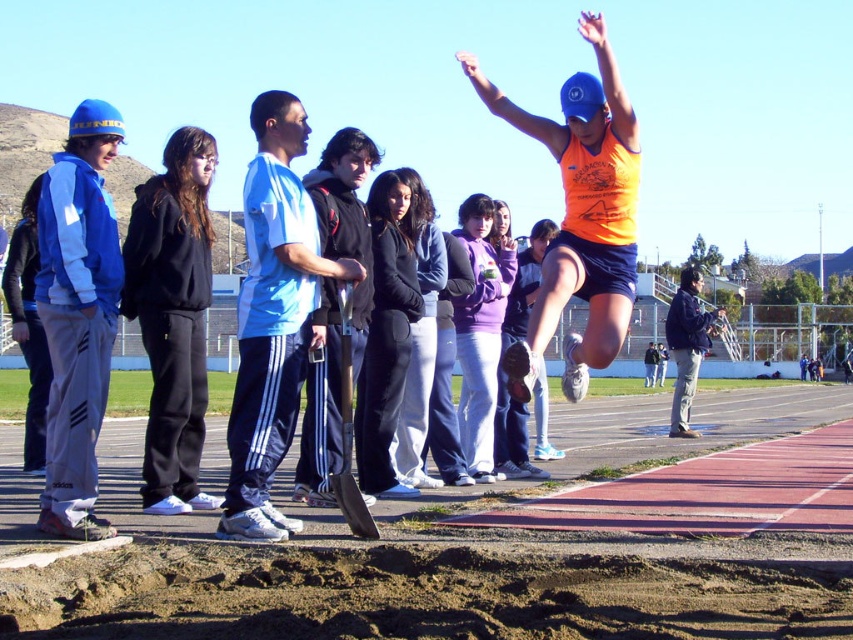
Where is `blue athletic wear at center`? The height and width of the screenshot is (640, 853). blue athletic wear at center is located at coordinates (273, 316).

Does blue athletic wear at center have a smaller size compared to blue denim jacket at upper center?

Indeed, blue athletic wear at center has a smaller size compared to blue denim jacket at upper center.

Is point (251, 241) farther from camera compared to point (692, 396)?

No, it is in front of (692, 396).

I want to click on blue athletic wear at center, so click(x=273, y=316).

Is brown sandy dirt track at lower center below blue athletic wear at center?

Indeed, brown sandy dirt track at lower center is positioned under blue athletic wear at center.

Can you confirm if brown sandy dirt track at lower center is bigger than blue athletic wear at center?

Yes.

Describe the element at coordinates (427, 577) in the screenshot. I see `brown sandy dirt track at lower center` at that location.

Image resolution: width=853 pixels, height=640 pixels. In order to click on brown sandy dirt track at lower center in this screenshot , I will do `click(427, 577)`.

Who is more forward, (468, 584) or (669, 429)?

Point (468, 584)

Is brown sandy dirt track at lower center bigger than blue denim jacket at upper center?

Actually, brown sandy dirt track at lower center might be smaller than blue denim jacket at upper center.

Does point (770, 429) lie behind point (685, 364)?

Yes.

Locate an element on the screen. This screenshot has width=853, height=640. brown sandy dirt track at lower center is located at coordinates (427, 577).